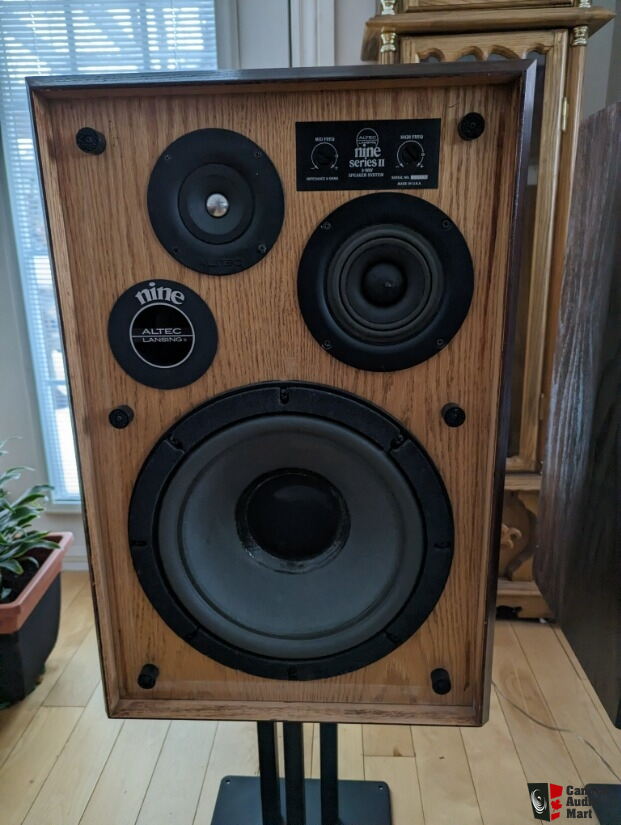
You are a GUI agent. You are given a task and a screenshot of the screen. Output one action in this format:
    pyautogui.click(x=<x>, y=<y>)
    Task: Click on the side of a dark green plant in black and tan pot
    The height and width of the screenshot is (825, 621).
    Given the screenshot: What is the action you would take?
    pyautogui.click(x=7, y=521), pyautogui.click(x=15, y=572), pyautogui.click(x=39, y=554)